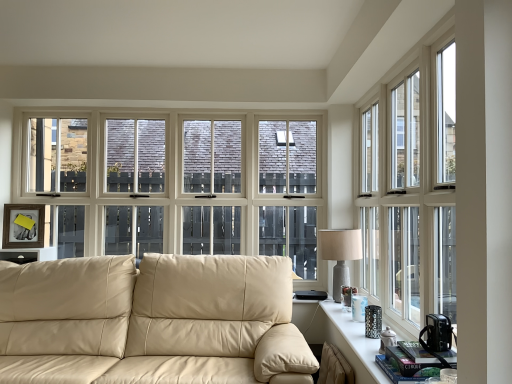
Question: From the image's perspective, is beige leather couch at center under matte black table at right?

Choices:
 (A) yes
 (B) no

Answer: (A)

Question: Is beige leather couch at center turned away from matte black table at right?

Choices:
 (A) yes
 (B) no

Answer: (B)

Question: Is beige leather couch at center not within matte black table at right?

Choices:
 (A) no
 (B) yes

Answer: (B)

Question: Is beige leather couch at center not close to matte black table at right?

Choices:
 (A) no
 (B) yes

Answer: (A)

Question: Can you confirm if beige leather couch at center is shorter than matte black table at right?

Choices:
 (A) no
 (B) yes

Answer: (A)

Question: Is beige leather couch at center bigger or smaller than matte black picture frame at left?

Choices:
 (A) big
 (B) small

Answer: (A)

Question: Is beige leather couch at center taller or shorter than matte black picture frame at left?

Choices:
 (A) tall
 (B) short

Answer: (A)

Question: From a real-world perspective, relative to matte black picture frame at left, is beige leather couch at center vertically above or below?

Choices:
 (A) above
 (B) below

Answer: (B)

Question: Would you say beige leather couch at center is to the left or to the right of matte black picture frame at left in the picture?

Choices:
 (A) left
 (B) right

Answer: (B)

Question: In terms of size, does clear glass window at right appear bigger or smaller than matte black picture frame at left?

Choices:
 (A) small
 (B) big

Answer: (B)

Question: In terms of width, does clear glass window at right look wider or thinner when compared to matte black picture frame at left?

Choices:
 (A) thin
 (B) wide

Answer: (B)

Question: From a real-world perspective, is clear glass window at right physically located above or below matte black picture frame at left?

Choices:
 (A) below
 (B) above

Answer: (B)

Question: Visually, is clear glass window at right positioned to the left or to the right of matte black picture frame at left?

Choices:
 (A) right
 (B) left

Answer: (A)

Question: Is point (13, 352) positioned closer to the camera than point (385, 375)?

Choices:
 (A) closer
 (B) farther

Answer: (B)

Question: In terms of height, does beige leather couch at center look taller or shorter compared to matte black table at right?

Choices:
 (A) tall
 (B) short

Answer: (A)